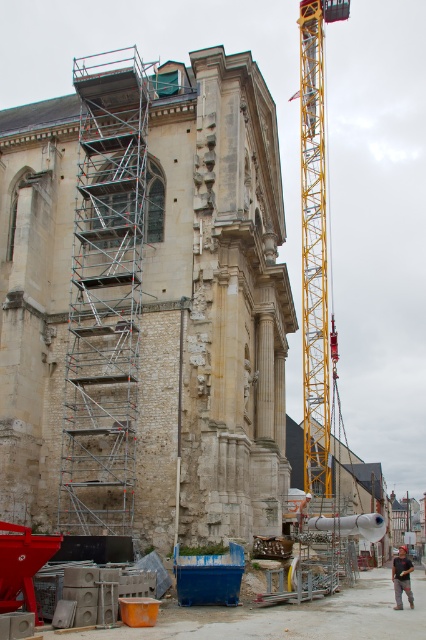
Is the position of yellow metallic crane at center more distant than that of dark gray shirt at center?

Yes.

Measure the distance between yellow metallic crane at center and dark gray shirt at center.

A distance of 256.37 feet exists between yellow metallic crane at center and dark gray shirt at center.

Locate an element on the screen. The width and height of the screenshot is (426, 640). yellow metallic crane at center is located at coordinates (314, 243).

Can you confirm if silver metallic scaffolding at left is thinner than yellow metallic crane at center?

Incorrect, silver metallic scaffolding at left's width is not less than yellow metallic crane at center's.

Does silver metallic scaffolding at left have a larger size compared to yellow metallic crane at center?

Yes, silver metallic scaffolding at left is bigger than yellow metallic crane at center.

Where is `silver metallic scaffolding at left`? silver metallic scaffolding at left is located at coordinates (104, 296).

At what (x,y) coordinates should I click in order to perform the action: click on silver metallic scaffolding at left. Please return your answer as a coordinate pair (x, y). This screenshot has height=640, width=426. Looking at the image, I should click on (104, 296).

Which is in front, point (63, 440) or point (402, 563)?

Point (402, 563) is more forward.

Image resolution: width=426 pixels, height=640 pixels. I want to click on silver metallic scaffolding at left, so click(104, 296).